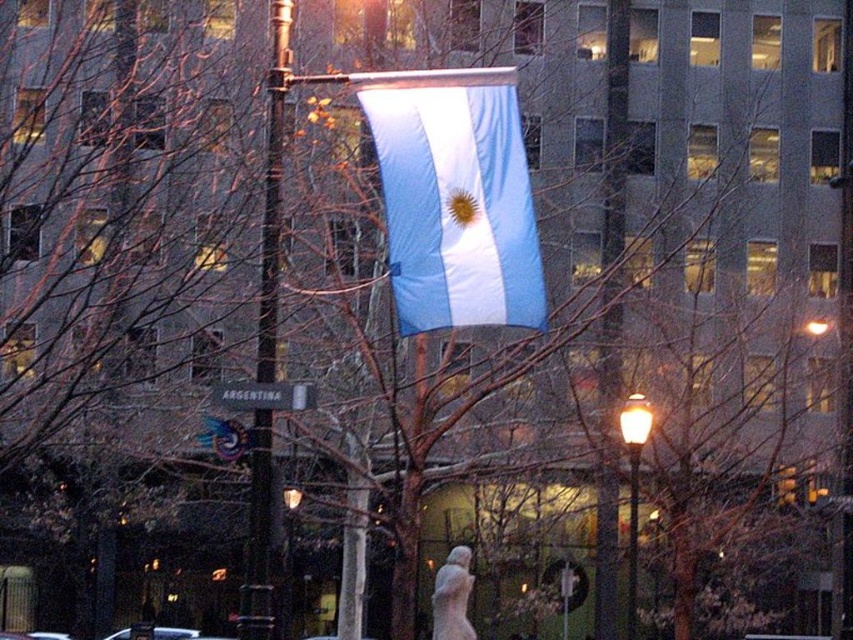
Question: Which point appears farthest from the camera in this image?

Choices:
 (A) (259, 435)
 (B) (292, 545)

Answer: (B)

Question: Can you confirm if matte black lamp post at right is positioned to the right of matte black lamp post at center?

Choices:
 (A) no
 (B) yes

Answer: (B)

Question: Can you confirm if matte black lamp post at right is thinner than white plastic street sign at center?

Choices:
 (A) no
 (B) yes

Answer: (A)

Question: Which object is closer to the camera taking this photo?

Choices:
 (A) metallic pole at center
 (B) matte black lamp post at right

Answer: (A)

Question: Can you confirm if blue fabric flag at center is positioned above white plastic street sign at center?

Choices:
 (A) no
 (B) yes

Answer: (B)

Question: Which object is closer to the camera taking this photo?

Choices:
 (A) matte black lamp post at right
 (B) blue fabric flag at center

Answer: (B)